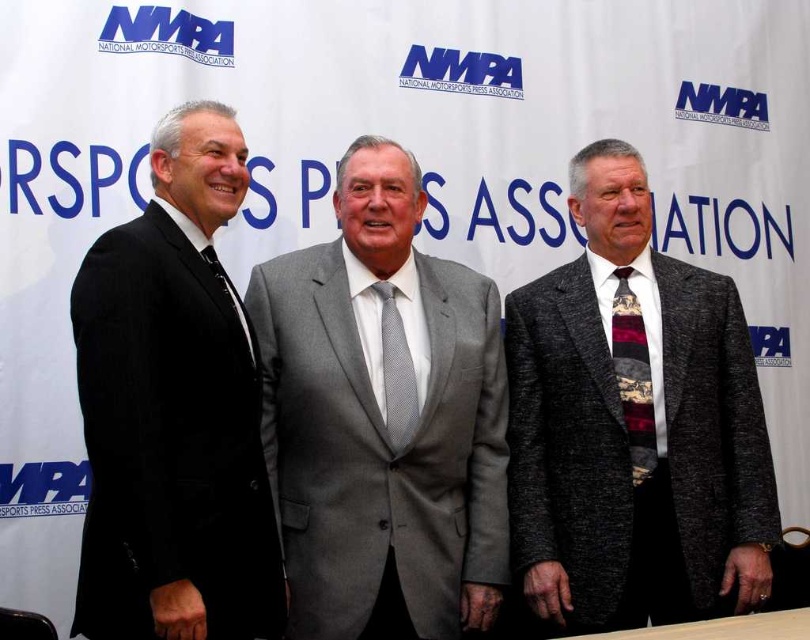
You are a photographer taking a picture of the three men. You notice the gray wool suit at center and the multicolored woven tie at right. Which one is positioned closer to the camera?

The gray wool suit at center is closer to the viewer than the multicolored woven tie at right, so the gray wool suit at center is positioned closer to the camera.

You are a fashion designer observing the three men in the National Motorsports Press Association backdrop. You need to determine which of the two items, the gray wool suit at center or the gray textured tie at center, is closer to the camera. Based on their positions, which one is nearer?

The gray wool suit at center is in front of the gray textured tie at center, so the gray wool suit at center is closer to the camera.

You are a photographer at the NMPA event. You need to adjust the lighting so that the multicolored woven tie at right and the matte black tie at left are both clearly visible. Which tie might require more light adjustment because of its position relative to the other?

The multicolored woven tie at right is below the matte black tie at left. Since it is positioned lower, it might require more light adjustment to ensure it is adequately lit compared to the upper tie.